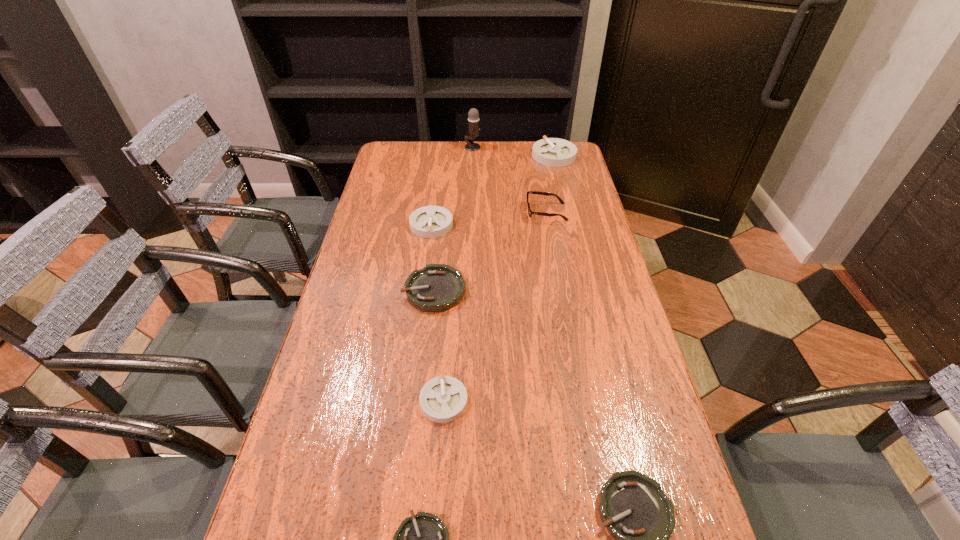
Image resolution: width=960 pixels, height=540 pixels. In order to click on green ashtray identified as the third closest to the microphone in this screenshot , I will do `click(423, 539)`.